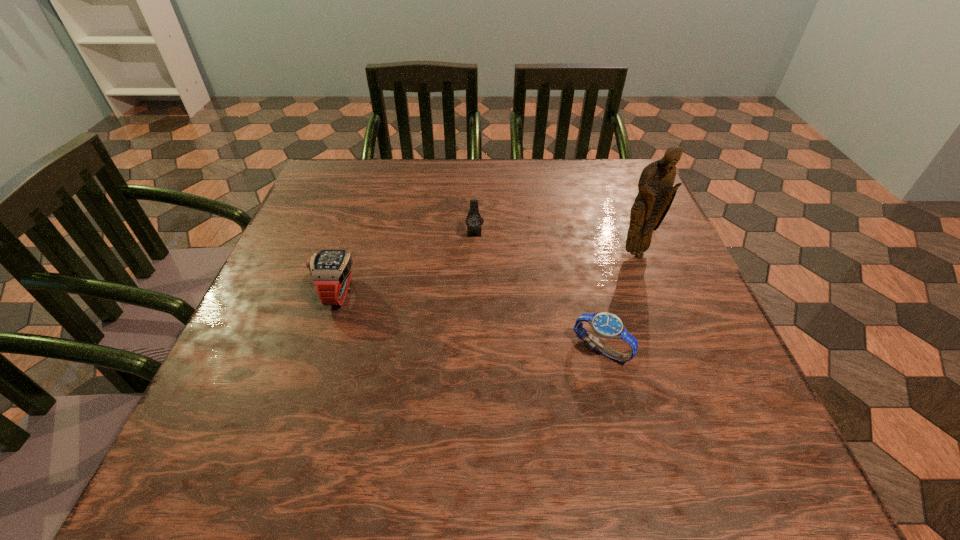
In the image, there is a desktop. Where is `vacant space at the far right corner`? This screenshot has height=540, width=960. vacant space at the far right corner is located at coordinates (588, 168).

In the image, there is a desktop. In order to click on vacant space at the near right corner in this screenshot , I will do click(702, 428).

Find the location of `empty location between the tallest object and the second object from left to right`. empty location between the tallest object and the second object from left to right is located at coordinates (555, 243).

At what (x,y) coordinates should I click in order to perform the action: click on free space between the third object from left to right and the farthest watch. Please return your answer as a coordinate pair (x, y). This screenshot has height=540, width=960. Looking at the image, I should click on (538, 291).

Where is `free point between the rightmost watch and the second watch from right to left`? The height and width of the screenshot is (540, 960). free point between the rightmost watch and the second watch from right to left is located at coordinates (538, 291).

The height and width of the screenshot is (540, 960). I want to click on vacant area that lies between the figurine and the nearest watch, so click(x=618, y=302).

Locate an element on the screen. The height and width of the screenshot is (540, 960). vacant area between the third object from left to right and the figurine is located at coordinates (618, 302).

This screenshot has height=540, width=960. What are the coordinates of `vacant point located between the second farthest watch and the farthest watch` in the screenshot? It's located at (406, 262).

Image resolution: width=960 pixels, height=540 pixels. Find the location of `vacant area between the rightmost watch and the second nearest object`. vacant area between the rightmost watch and the second nearest object is located at coordinates (469, 321).

At what (x,y) coordinates should I click in order to perform the action: click on vacant point located between the third nearest object and the farthest object. Please return your answer as a coordinate pair (x, y). Image resolution: width=960 pixels, height=540 pixels. Looking at the image, I should click on (555, 243).